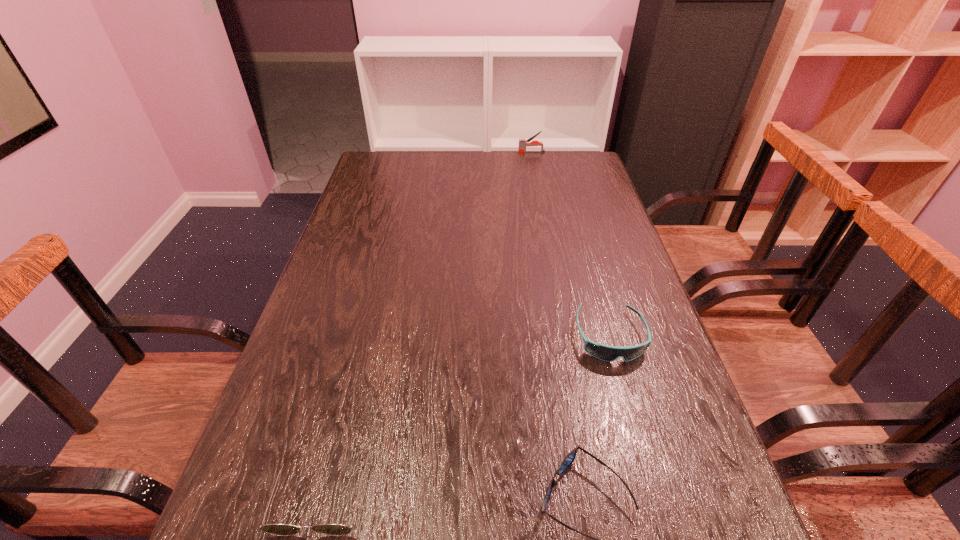
Find the location of `free spot between the leftmost sunglasses and the third nearest object`. free spot between the leftmost sunglasses and the third nearest object is located at coordinates (466, 414).

Where is `empty space between the stapler and the second farthest object`? Image resolution: width=960 pixels, height=540 pixels. empty space between the stapler and the second farthest object is located at coordinates (570, 244).

Select which object appears as the closest to the farthest object. Please provide its 2D coordinates. Your answer should be formatted as a tuple, i.e. [(x, y)], where the tuple contains the x and y coordinates of a point satisfying the conditions above.

[(603, 352)]

Find the location of a particular element. This screenshot has width=960, height=540. the second closest object relative to the leftmost object is located at coordinates (603, 352).

Identify which sunglasses is the second nearest to the tallest object. Please provide its 2D coordinates. Your answer should be formatted as a tuple, i.e. [(x, y)], where the tuple contains the x and y coordinates of a point satisfying the conditions above.

[(569, 459)]

Point out which sunglasses is positioned as the second nearest to the farthest object. Please provide its 2D coordinates. Your answer should be formatted as a tuple, i.e. [(x, y)], where the tuple contains the x and y coordinates of a point satisfying the conditions above.

[(569, 459)]

This screenshot has height=540, width=960. Find the location of `vacant space that satisfies the following two spatial constraints: 1. on the handle side of the stapler; 2. on the front-facing side of the leftmost sunglasses`. vacant space that satisfies the following two spatial constraints: 1. on the handle side of the stapler; 2. on the front-facing side of the leftmost sunglasses is located at coordinates (595, 492).